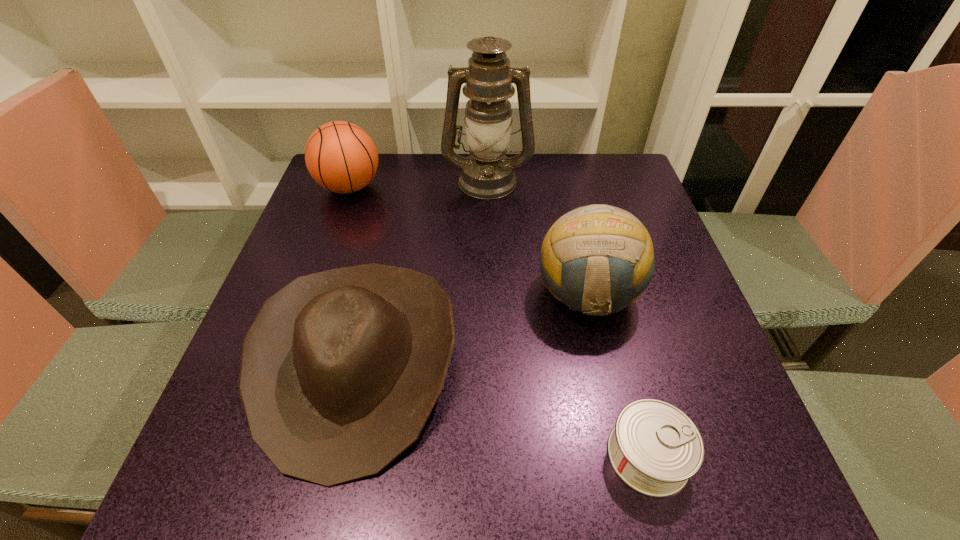
Where is `free area in between the can and the volleyball`? The width and height of the screenshot is (960, 540). free area in between the can and the volleyball is located at coordinates (618, 375).

The image size is (960, 540). In order to click on empty space between the oil lamp and the can in this screenshot , I will do `click(567, 318)`.

The image size is (960, 540). I want to click on free space between the can and the cowboy hat, so click(502, 409).

What are the coordinates of `vacant region between the cowboy hat and the tallest object` in the screenshot? It's located at (422, 271).

At what (x,y) coordinates should I click in order to perform the action: click on vacant area between the tallest object and the basketball. Please return your answer as a coordinate pair (x, y). The height and width of the screenshot is (540, 960). Looking at the image, I should click on (419, 184).

Image resolution: width=960 pixels, height=540 pixels. Find the location of `free area in between the volleyball and the fourth tallest object`. free area in between the volleyball and the fourth tallest object is located at coordinates (472, 328).

Locate an element on the screen. This screenshot has width=960, height=540. blank region between the basketball and the tallest object is located at coordinates (419, 184).

Identify which object is located as the fourth nearest to the fourth tallest object. Please provide its 2D coordinates. Your answer should be formatted as a tuple, i.e. [(x, y)], where the tuple contains the x and y coordinates of a point satisfying the conditions above.

[(487, 173)]

You are a GUI agent. You are given a task and a screenshot of the screen. Output one action in this format:
    pyautogui.click(x=<x>, y=<y>)
    Task: Click on the closest object to the oil lamp
    
    Given the screenshot: What is the action you would take?
    pyautogui.click(x=340, y=156)

Locate an element on the screen. This screenshot has height=540, width=960. vacant position in the image that satisfies the following two spatial constraints: 1. on the back side of the basketball; 2. on the right side of the oil lamp is located at coordinates (352, 180).